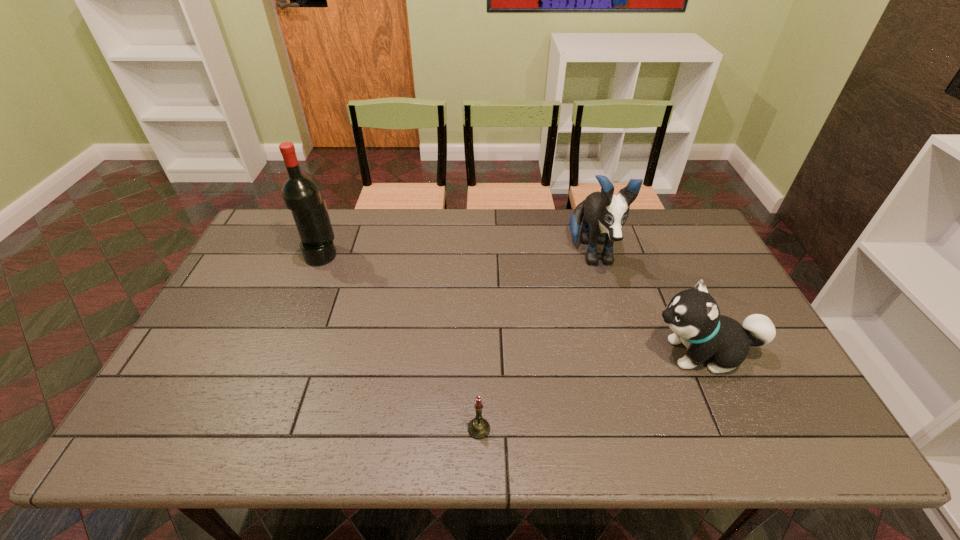
The height and width of the screenshot is (540, 960). Find the location of `wine bottle`. wine bottle is located at coordinates (301, 195).

Where is `the second object from right to left`? the second object from right to left is located at coordinates (605, 214).

This screenshot has height=540, width=960. I want to click on the left puppy, so click(605, 214).

Image resolution: width=960 pixels, height=540 pixels. In order to click on the nearer puppy in this screenshot , I will do `click(693, 315)`.

You are a GUI agent. You are given a task and a screenshot of the screen. Output one action in this format:
    pyautogui.click(x=<x>, y=<y>)
    Task: Click on the right puppy
    
    Given the screenshot: What is the action you would take?
    [693, 315]

I want to click on the nearest object, so click(x=478, y=428).

Locate an element on the screen. Image resolution: width=960 pixels, height=540 pixels. the shortest object is located at coordinates (478, 428).

Locate an element on the screen. The width and height of the screenshot is (960, 540). free space located on the front of the leftmost object is located at coordinates (302, 301).

Image resolution: width=960 pixels, height=540 pixels. In order to click on free space located 0.110m on the front-facing side of the third object from left to right in this screenshot , I will do `click(609, 314)`.

At what (x,y) coordinates should I click in order to perform the action: click on vacant space located 0.060m at the face of the shorter puppy. Please return your answer as a coordinate pair (x, y). This screenshot has width=960, height=540. Looking at the image, I should click on (624, 353).